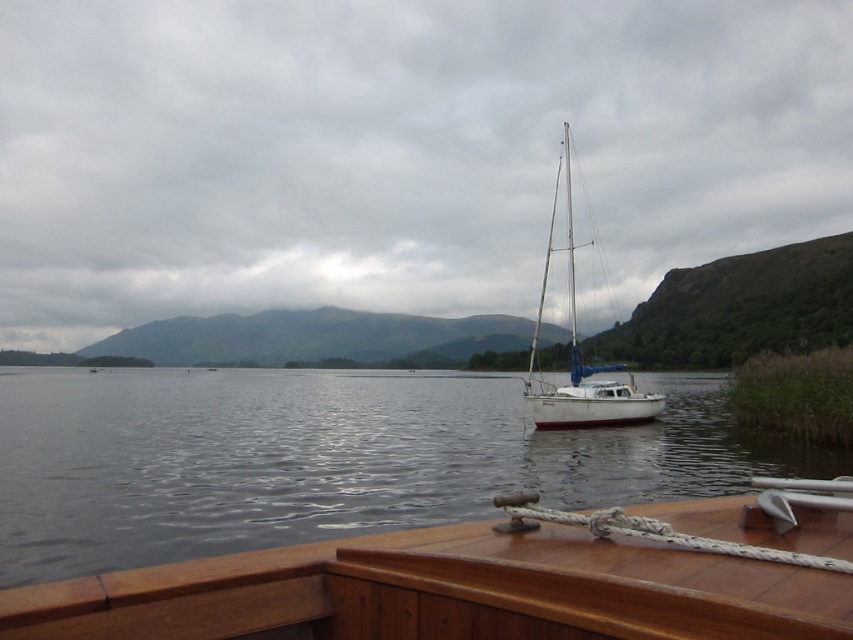
You are standing at the edge of the lake and notice the wooden deck at center. Based on its position, can you estimate whether it is closer to the water or further away from it?

The wooden deck at center is located at point (x=486, y=582), which places it closer to the water since it is positioned in the foreground of the scene.

You are standing on the lakeside and see the clear water at center and the white matte sailboat at center. Which object is closer to you?

The clear water at center is closer to the viewer than the white matte sailboat at center.